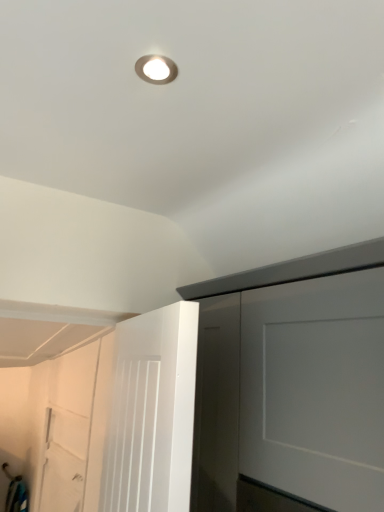
What are the coordinates of `matte silver droplight at upper center` in the screenshot? It's located at (156, 69).

From the image's perspective, which is below, white matte door at lower left or matte silver droplight at upper center?

white matte door at lower left is shown below in the image.

Is white matte door at lower left completely or partially outside of matte silver droplight at upper center?

Yes, white matte door at lower left is located beyond the bounds of matte silver droplight at upper center.

Could you tell me if white matte door at lower left is turned towards matte silver droplight at upper center?

No, white matte door at lower left is not oriented towards matte silver droplight at upper center.

Considering the relative positions of white matte door at lower left and matte silver droplight at upper center in the image provided, is white matte door at lower left to the left of matte silver droplight at upper center from the viewer's perspective?

Indeed, white matte door at lower left is positioned on the left side of matte silver droplight at upper center.

From a real-world perspective, is white matte door at lower left beneath matte silver droplight at upper center?

Indeed, from a real-world perspective, white matte door at lower left is positioned beneath matte silver droplight at upper center.

Is point (124, 497) closer to camera compared to point (152, 61)?

Yes, point (124, 497) is closer to viewer.

Is white matte door at lower left with white matte door at lower left?

No, white matte door at lower left is not beside white matte door at lower left.

Is point (150, 316) less distant than point (43, 492)?

Yes.

Which object is positioned more to the right, white matte door at lower left or white matte door at lower left?

white matte door at lower left is more to the right.

Would you say matte silver droplight at upper center is to the left or to the right of white matte door at lower left in the picture?

From the image, it's evident that matte silver droplight at upper center is to the right of white matte door at lower left.

Is matte silver droplight at upper center positioned beyond the bounds of white matte door at lower left?

Yes, matte silver droplight at upper center is not within white matte door at lower left.

Is matte silver droplight at upper center in front of white matte door at lower left?

Yes, matte silver droplight at upper center is closer to the camera.

Between matte silver droplight at upper center and white matte door at lower left, which one has smaller size?

With smaller size is matte silver droplight at upper center.

From the image's perspective, is matte silver droplight at upper center positioned above or below white matte door at lower left?

matte silver droplight at upper center is situated higher than white matte door at lower left in the image.

Looking at this image, from a real-world perspective, is matte silver droplight at upper center under white matte door at lower left?

Incorrect, from a real-world perspective, matte silver droplight at upper center is higher than white matte door at lower left.

Can you confirm if matte silver droplight at upper center is bigger than white matte door at lower left?

Actually, matte silver droplight at upper center might be smaller than white matte door at lower left.

Based on their positions, is matte silver droplight at upper center located to the left or right of white matte door at lower left?

In the image, matte silver droplight at upper center appears on the right side of white matte door at lower left.

What's the angular difference between white matte door at lower left and white matte door at lower left's facing directions?

white matte door at lower left and white matte door at lower left are facing 9.55 degrees away from each other.

This screenshot has height=512, width=384. Identify the location of garage door behind the white matte door at lower left. (67, 430).

Considering the relative positions of white matte door at lower left and white matte door at lower left in the image provided, is white matte door at lower left to the left or to the right of white matte door at lower left?

Based on their positions, white matte door at lower left is located to the left of white matte door at lower left.

Is white matte door at lower left in contact with white matte door at lower left?

white matte door at lower left and white matte door at lower left are not in contact.

Where is `droplight that appears above the white matte door at lower left (from a real-world perspective)`? The width and height of the screenshot is (384, 512). droplight that appears above the white matte door at lower left (from a real-world perspective) is located at coordinates (156, 69).

Locate an element on the screen. This screenshot has height=512, width=384. door located on the left of matte silver droplight at upper center is located at coordinates (152, 413).

When comparing their distances from white matte door at lower left, does white matte door at lower left or matte silver droplight at upper center seem closer?

Based on the image, matte silver droplight at upper center appears to be nearer to white matte door at lower left.

Looking at this image, considering their positions, is matte silver droplight at upper center positioned closer to white matte door at lower left than white matte door at lower left?

white matte door at lower left lies closer to white matte door at lower left than the other object.

From the image, which object appears to be nearer to white matte door at lower left, matte silver droplight at upper center or white matte door at lower left?

matte silver droplight at upper center is closer to white matte door at lower left.

Looking at the image, which one is located further to white matte door at lower left, white matte door at lower left or matte silver droplight at upper center?

matte silver droplight at upper center is positioned further to the anchor white matte door at lower left.

Estimate the real-world distances between objects in this image. Which object is closer to matte silver droplight at upper center, white matte door at lower left or white matte door at lower left?

The object closer to matte silver droplight at upper center is white matte door at lower left.

When comparing their distances from matte silver droplight at upper center, does white matte door at lower left or white matte door at lower left seem closer?

white matte door at lower left lies closer to matte silver droplight at upper center than the other object.

Where is `door between matte silver droplight at upper center and white matte door at lower left from top to bottom`? The image size is (384, 512). door between matte silver droplight at upper center and white matte door at lower left from top to bottom is located at coordinates (152, 413).